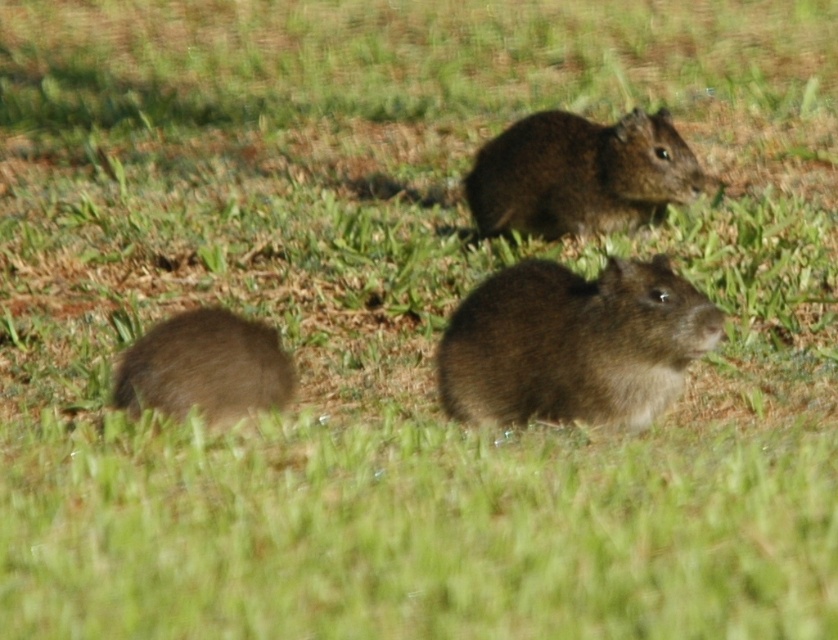
Question: Which object appears farthest from the camera in this image?

Choices:
 (A) brown furry mouse at upper center
 (B) brown furry mouse at center
 (C) brown furry mouse at lower left

Answer: (A)

Question: Is brown furry mouse at upper center behind brown furry mouse at lower left?

Choices:
 (A) yes
 (B) no

Answer: (A)

Question: Is brown furry mouse at upper center to the left of brown furry mouse at lower left from the viewer's perspective?

Choices:
 (A) no
 (B) yes

Answer: (A)

Question: Which point is farther to the camera?

Choices:
 (A) brown furry mouse at center
 (B) brown furry mouse at lower left

Answer: (B)

Question: Is brown furry mouse at center wider than brown furry mouse at lower left?

Choices:
 (A) no
 (B) yes

Answer: (B)

Question: Among these points, which one is nearest to the camera?

Choices:
 (A) (562, 388)
 (B) (661, 172)

Answer: (A)